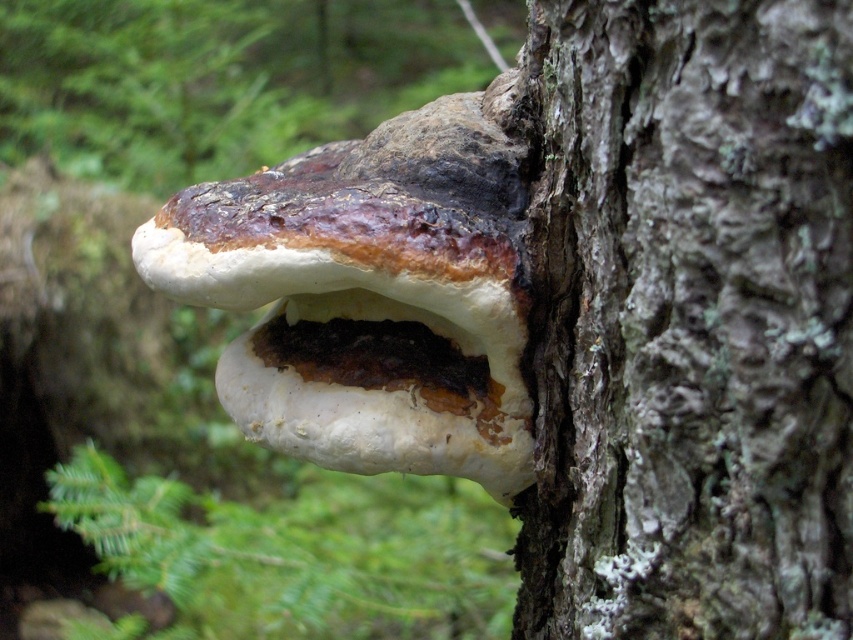
Which is in front, point (668, 108) or point (323, 374)?

Point (668, 108) is more forward.

Is point (782, 234) positioned in front of point (392, 292)?

Yes, it is.

Find the location of a particular element. The image size is (853, 640). smooth bark tree trunk at center is located at coordinates (689, 320).